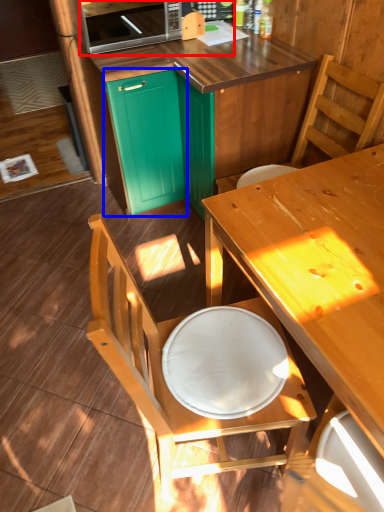
Question: Which point is closer to the camera, microwave oven (highlighted by a red box) or cabinetry (highlighted by a blue box)?

Choices:
 (A) microwave oven
 (B) cabinetry

Answer: (A)